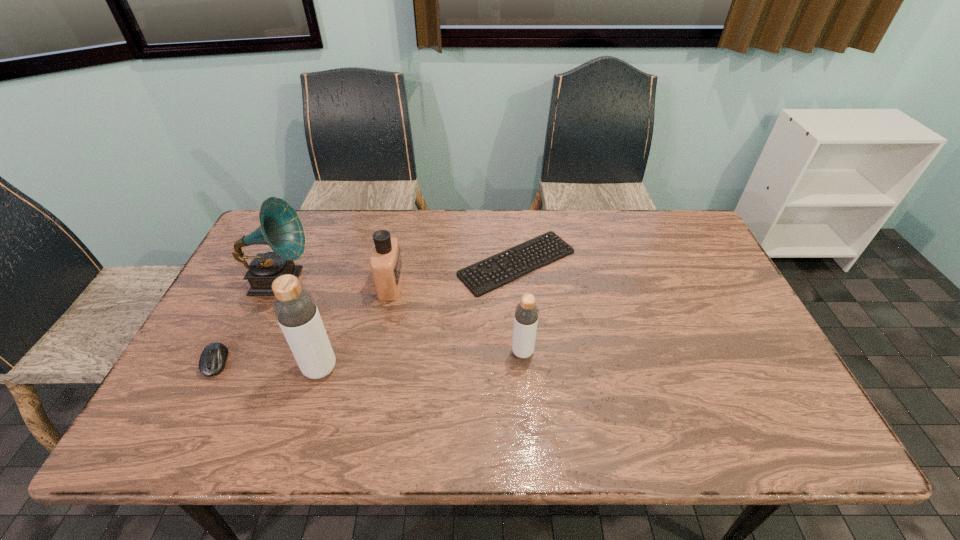
I want to click on free space that satisfies the following two spatial constraints: 1. on the back side of the computer keyboard; 2. on the right side of the shorter bottle, so click(516, 263).